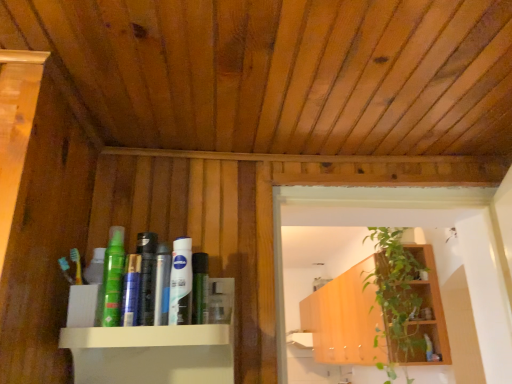
Image resolution: width=512 pixels, height=384 pixels. Describe the element at coordinates (113, 277) in the screenshot. I see `green matte spray can at center, marked as the 1th toiletry in a front-to-back arrangement` at that location.

Describe the element at coordinates (161, 285) in the screenshot. This screenshot has height=384, width=512. I see `silver metallic can at center, the 5th toiletry positioned from the back` at that location.

What is the approximate width of shiny black bottle at center, which appears as the fourth toiletry when viewed from the back?

shiny black bottle at center, which appears as the fourth toiletry when viewed from the back, is 1.25 inches in width.

Where is `green matte spray can at center, the 7th toiletry in the back-to-front sequence`? green matte spray can at center, the 7th toiletry in the back-to-front sequence is located at coordinates (113, 277).

Looking at this image, is matte black hair spray at upper center, acting as the 7th toiletry starting from the front, thinner than green matte spray can at center, the 1th toiletry when ordered from left to right?

No.

Looking at this image, is matte black hair spray at upper center, acting as the 7th toiletry starting from the front, to the left of green matte spray can at center, the 1th toiletry when ordered from left to right, from the viewer's perspective?

Incorrect, matte black hair spray at upper center, acting as the 7th toiletry starting from the front, is not on the left side of green matte spray can at center, the 1th toiletry when ordered from left to right.

Which is closer, [423,308] or [106,281]?

Clearly, point [423,308] is more distant from the camera than point [106,281].

How different are the orientations of matte black hair spray at upper center, which appears as the seventh toiletry when viewed from the left, and green matte spray can at center, which ranks as the seventh toiletry in right-to-left order, in degrees?

The angular difference between matte black hair spray at upper center, which appears as the seventh toiletry when viewed from the left, and green matte spray can at center, which ranks as the seventh toiletry in right-to-left order, is 2.35 degrees.

From a real-world perspective, which object stands above the other?

In real-world perspective, matte black hair spray at upper center, acting as the 7th toiletry starting from the front, is above.

Could you tell me if green matte spray can at center, marked as the 1th toiletry in a front-to-back arrangement, is turned towards matte black hair spray at upper center, the first toiletry positioned from the back?

No, green matte spray can at center, marked as the 1th toiletry in a front-to-back arrangement, does not turn towards matte black hair spray at upper center, the first toiletry positioned from the back.

Considering the sizes of green matte spray can at center, the 1th toiletry when ordered from left to right, and matte black hair spray at upper center, which appears as the seventh toiletry when viewed from the left, in the image, is green matte spray can at center, the 1th toiletry when ordered from left to right, taller or shorter than matte black hair spray at upper center, which appears as the seventh toiletry when viewed from the left,?

green matte spray can at center, the 1th toiletry when ordered from left to right, is taller than matte black hair spray at upper center, which appears as the seventh toiletry when viewed from the left.

How much distance is there between green matte spray can at center, which ranks as the seventh toiletry in right-to-left order, and matte black hair spray at upper center, acting as the 7th toiletry starting from the front?

7.40 feet.

In the image, is white glossy lotion at center, which ranks as the second toiletry in front-to-back order, positioned in front of or behind silver metallic can at center, which is the 3th toiletry from left to right?

Clearly, white glossy lotion at center, which ranks as the second toiletry in front-to-back order, is in front of silver metallic can at center, which is the 3th toiletry from left to right.

From the image's perspective, which toiletry is the 2nd one above the silver metallic can at center, the fifth toiletry viewed from the right? Please provide its 2D coordinates.

[(181, 282)]

Between white glossy lotion at center, which ranks as the second toiletry in front-to-back order, and silver metallic can at center, the 5th toiletry positioned from the back, which one has smaller size?

silver metallic can at center, the 5th toiletry positioned from the back.

Between white glossy lotion at center, which ranks as the 4th toiletry in left-to-right order, and silver metallic can at center, the 5th toiletry positioned from the back, which one has more height?

white glossy lotion at center, which ranks as the 4th toiletry in left-to-right order.

Considering the sizes of objects green matte tube at center, acting as the 3th toiletry starting from the right, and green matte spray can at center, the 7th toiletry in the back-to-front sequence, in the image provided, who is shorter, green matte tube at center, acting as the 3th toiletry starting from the right, or green matte spray can at center, the 7th toiletry in the back-to-front sequence,?

green matte tube at center, acting as the 3th toiletry starting from the right, is shorter.

Are green matte tube at center, marked as the 5th toiletry in a front-to-back arrangement, and green matte spray can at center, the 1th toiletry when ordered from left to right, making contact?

No.

Looking at their sizes, would you say green matte tube at center, acting as the 3th toiletry starting from the right, is wider or thinner than green matte spray can at center, which ranks as the seventh toiletry in right-to-left order?

Clearly, green matte tube at center, acting as the 3th toiletry starting from the right, has more width compared to green matte spray can at center, which ranks as the seventh toiletry in right-to-left order.

Which is behind, point (110, 285) or point (362, 266)?

The point (362, 266) is more distant.

How much distance is there between green matte spray can at center, marked as the 1th toiletry in a front-to-back arrangement, and wooden cabinet at center?

green matte spray can at center, marked as the 1th toiletry in a front-to-back arrangement, and wooden cabinet at center are 8.15 feet apart.

In the image, is green matte spray can at center, the 1th toiletry when ordered from left to right, positioned in front of or behind wooden cabinet at center?

Clearly, green matte spray can at center, the 1th toiletry when ordered from left to right, is in front of wooden cabinet at center.

In terms of size, does green matte spray can at center, marked as the 1th toiletry in a front-to-back arrangement, appear bigger or smaller than wooden cabinet at center?

Considering their sizes, green matte spray can at center, marked as the 1th toiletry in a front-to-back arrangement, takes up less space than wooden cabinet at center.

You are a GUI agent. You are given a task and a screenshot of the screen. Output one action in this format:
    pyautogui.click(x=<x>, y=<y>)
    Task: Click on the 4th toiletry directly beneath the wooden cabinet at center (from a real-world perspective)
    
    Given the screenshot: What is the action you would take?
    pyautogui.click(x=181, y=282)

Visually, is wooden cabinet at center positioned to the left or to the right of white glossy lotion at center, which ranks as the second toiletry in front-to-back order?

Clearly, wooden cabinet at center is on the right of white glossy lotion at center, which ranks as the second toiletry in front-to-back order, in the image.

Is point (362, 321) positioned before point (173, 298)?

No.

Consider the image. Is matte black hair spray at upper center, the 1th toiletry when ordered from right to left, situated inside silver metallic can at center, the 5th toiletry positioned from the back, or outside?

matte black hair spray at upper center, the 1th toiletry when ordered from right to left, exists outside the volume of silver metallic can at center, the 5th toiletry positioned from the back.

Is matte black hair spray at upper center, which appears as the seventh toiletry when viewed from the left, taller or shorter than silver metallic can at center, which is the 3th toiletry from left to right?

Clearly, matte black hair spray at upper center, which appears as the seventh toiletry when viewed from the left, is shorter compared to silver metallic can at center, which is the 3th toiletry from left to right.

Is matte black hair spray at upper center, acting as the 7th toiletry starting from the front, next to silver metallic can at center, the 5th toiletry positioned from the back, and touching it?

No.

Which object is further away from the camera taking this photo, matte black hair spray at upper center, the 1th toiletry when ordered from right to left, or silver metallic can at center, the 5th toiletry positioned from the back?

matte black hair spray at upper center, the 1th toiletry when ordered from right to left.

The image size is (512, 384). Find the location of `the 6th toiletry in front of the matte black hair spray at upper center, acting as the 7th toiletry starting from the front, starting your count from the anchor`. the 6th toiletry in front of the matte black hair spray at upper center, acting as the 7th toiletry starting from the front, starting your count from the anchor is located at coordinates (113, 277).

Where is `the 6th toiletry to the left when counting from the matte black hair spray at upper center, the 1th toiletry when ordered from right to left`? Image resolution: width=512 pixels, height=384 pixels. the 6th toiletry to the left when counting from the matte black hair spray at upper center, the 1th toiletry when ordered from right to left is located at coordinates (113, 277).

Looking at this image, based on their spatial positions, is shiny black bottle at center, the second toiletry in the left-to-right sequence, or white glossy lotion at center, which ranks as the second toiletry in front-to-back order, closer to silver metallic can at center, the fifth toiletry viewed from the right?

Among the two, shiny black bottle at center, the second toiletry in the left-to-right sequence, is located nearer to silver metallic can at center, the fifth toiletry viewed from the right.

Looking at the image, which one is located closer to blue matte toothpaste at center, shiny black bottle at center, the fourth toiletry in the front-to-back sequence, or green leafy plant at upper right?

shiny black bottle at center, the fourth toiletry in the front-to-back sequence.

From the image, which object appears to be nearer to green leafy plant at upper right, white glossy lotion at center, marked as the sixth toiletry in a back-to-front arrangement, or matte black hair spray at upper center, the 1th toiletry when ordered from right to left?

matte black hair spray at upper center, the 1th toiletry when ordered from right to left, is closer to green leafy plant at upper right.

Based on their spatial positions, is green matte tube at center, acting as the 3th toiletry starting from the back, or matte black hair spray at upper center, acting as the 7th toiletry starting from the front, closer to silver metallic can at center, the 5th toiletry positioned from the back?

The object closer to silver metallic can at center, the 5th toiletry positioned from the back, is green matte tube at center, acting as the 3th toiletry starting from the back.

From the image, which object appears to be farther from shiny black bottle at center, the fourth toiletry in the front-to-back sequence, green matte spray can at center, marked as the 1th toiletry in a front-to-back arrangement, or green leafy plant at upper right?

Based on the image, green leafy plant at upper right appears to be further to shiny black bottle at center, the fourth toiletry in the front-to-back sequence.

In the scene shown: Estimate the real-world distances between objects in this image. Which object is closer to wooden cabinet at center, blue matte toothpaste at center or green matte spray can at center, which ranks as the seventh toiletry in right-to-left order?

green matte spray can at center, which ranks as the seventh toiletry in right-to-left order, is closer to wooden cabinet at center.

Estimate the real-world distances between objects in this image. Which object is closer to green leafy plant at upper right, blue matte toothpaste at center or green matte spray can at center, marked as the 1th toiletry in a front-to-back arrangement?

green matte spray can at center, marked as the 1th toiletry in a front-to-back arrangement, is positioned closer to the anchor green leafy plant at upper right.

When comparing their distances from green matte spray can at center, which ranks as the seventh toiletry in right-to-left order, does clear plastic bottle at center, the second toiletry in the right-to-left sequence, or shiny black bottle at center, the sixth toiletry viewed from the right, seem closer?

shiny black bottle at center, the sixth toiletry viewed from the right.

Find the location of `houseplant located between silver metallic can at center, the 5th toiletry positioned from the back, and wooden cabinet at center in the depth direction`. houseplant located between silver metallic can at center, the 5th toiletry positioned from the back, and wooden cabinet at center in the depth direction is located at coordinates (396, 298).

You are a GUI agent. You are given a task and a screenshot of the screen. Output one action in this format:
    pyautogui.click(x=<x>, y=<y>)
    Task: Click on the shelf between shiny black bottle at center, the second toiletry in the left-to-right sequence, and matte black hair spray at upper center, the first toiletry positioned from the back, in the front-back direction
    
    Given the screenshot: What is the action you would take?
    pyautogui.click(x=372, y=316)

Locate an element on the screen. The width and height of the screenshot is (512, 384). houseplant between white glossy lotion at center, which ranks as the second toiletry in front-to-back order, and matte black hair spray at upper center, acting as the 7th toiletry starting from the front, along the z-axis is located at coordinates (396, 298).

You are a GUI agent. You are given a task and a screenshot of the screen. Output one action in this format:
    pyautogui.click(x=<x>, y=<y>)
    Task: Click on the toothpaste between green matte spray can at center, which ranks as the seventh toiletry in right-to-left order, and green matte tube at center, marked as the 5th toiletry in a front-to-back arrangement, in the horizontal direction
    The width and height of the screenshot is (512, 384).
    Given the screenshot: What is the action you would take?
    pyautogui.click(x=131, y=290)